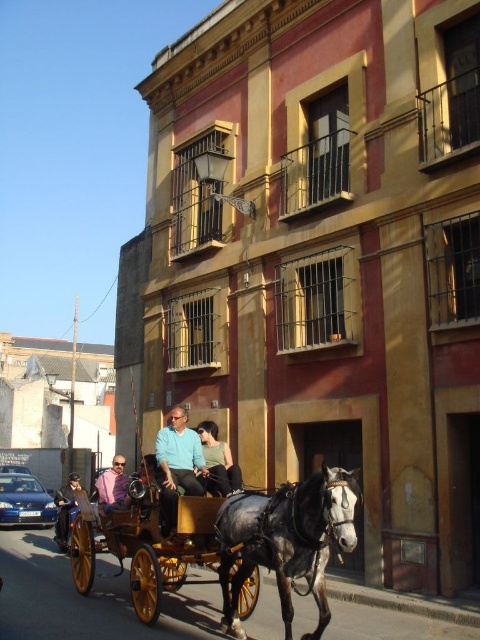
You are a photographer standing on the sidewalk, wanting to capture a photo of the gray glossy horse at center and the pink fabric shirt at center in the same frame. Considering their sizes, which object should you focus on first to ensure both are clearly visible in the photo?

The gray glossy horse at center is larger than the pink fabric shirt at center, so you should focus on the gray glossy horse at center first to ensure both are clearly visible in the photo.

Consider the image. You are a tour guide leading a group through the historic city streets. You need to ensure that a 3.0 meter long banner can be placed between the gray glossy horse at center and the wooden polished cart at center without touching either. Is this possible?

The distance between the gray glossy horse at center and the wooden polished cart at center is 2.61 meters. Since the banner is 3.0 meters long, it cannot be placed between them without overlapping or touching either object.